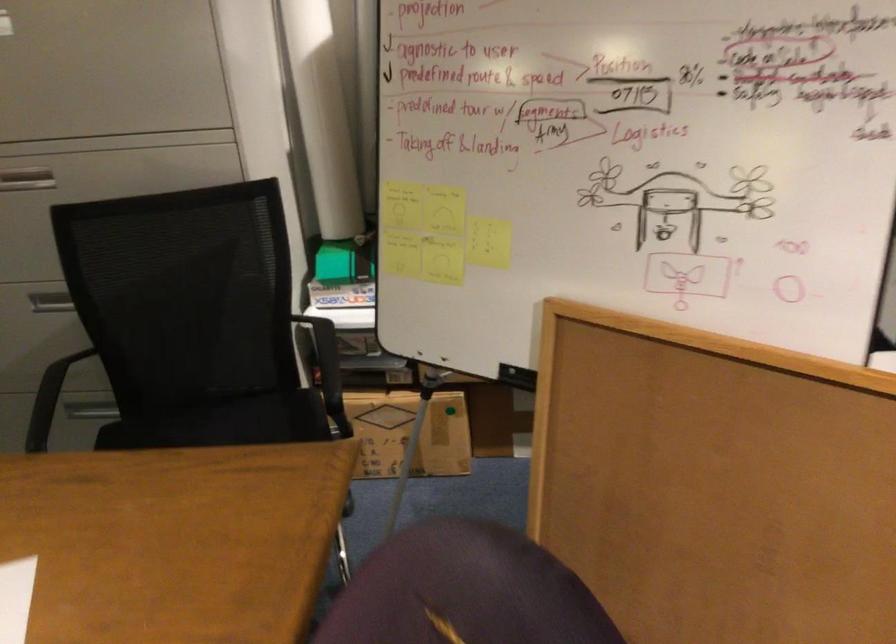
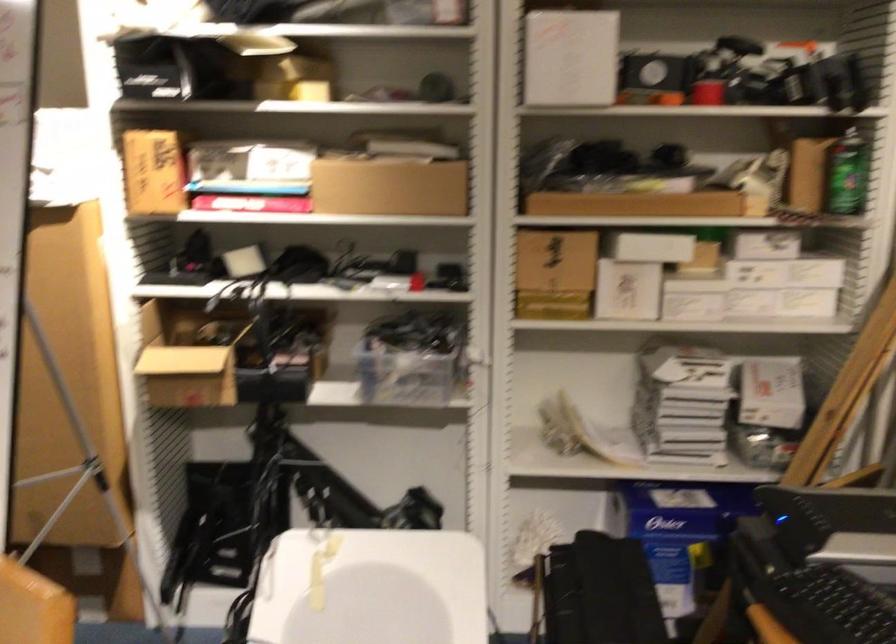
Question: The images are taken continuously from a first-person perspective. In which direction is your viewpoint rotating?

Choices:
 (A) Left
 (B) Right
 (C) Up
 (D) Down

Answer: (C)